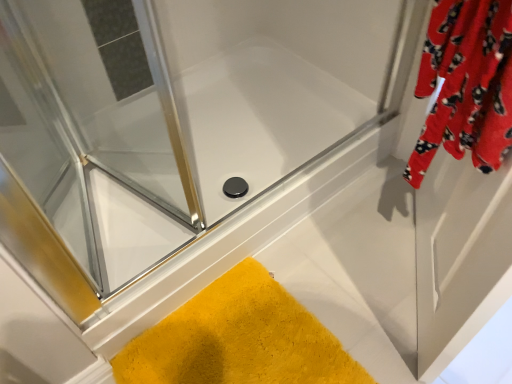
Question: Considering the relative positions of yellow fuzzy bath mat at lower left and transparent glass shower door at upper left, which is the 2th screen door from right to left, in the image provided, is yellow fuzzy bath mat at lower left to the right of transparent glass shower door at upper left, which is the 2th screen door from right to left, from the viewer's perspective?

Choices:
 (A) no
 (B) yes

Answer: (B)

Question: Is yellow fuzzy bath mat at lower left oriented towards transparent glass shower door at upper left, which is the 2th screen door from right to left?

Choices:
 (A) no
 (B) yes

Answer: (A)

Question: From the image's perspective, is yellow fuzzy bath mat at lower left over transparent glass shower door at upper left, which is the 2th screen door from right to left?

Choices:
 (A) yes
 (B) no

Answer: (B)

Question: Does yellow fuzzy bath mat at lower left appear on the left side of transparent glass shower door at upper left, the first screen door positioned from the left?

Choices:
 (A) no
 (B) yes

Answer: (A)

Question: Does yellow fuzzy bath mat at lower left have a lesser width compared to transparent glass shower door at upper left, the first screen door positioned from the left?

Choices:
 (A) no
 (B) yes

Answer: (B)

Question: Does point (75, 162) appear closer or farther from the camera than point (184, 382)?

Choices:
 (A) farther
 (B) closer

Answer: (A)

Question: From the image's perspective, relative to yellow fuzzy bath mat at lower left, is transparent glass shower door at upper left, the first screen door positioned from the left, above or below?

Choices:
 (A) below
 (B) above

Answer: (B)

Question: In terms of size, does transparent glass shower door at upper left, which is the 2th screen door from right to left, appear bigger or smaller than yellow fuzzy bath mat at lower left?

Choices:
 (A) big
 (B) small

Answer: (A)

Question: Based on their positions, is transparent glass shower door at upper left, the first screen door positioned from the left, located to the left or right of yellow fuzzy bath mat at lower left?

Choices:
 (A) right
 (B) left

Answer: (B)

Question: Is yellow fuzzy bath mat at lower left in front of or behind velvet red robe at upper right, which appears as the 1th screen door when viewed from the right, in the image?

Choices:
 (A) front
 (B) behind

Answer: (B)

Question: Is yellow fuzzy bath mat at lower left bigger or smaller than velvet red robe at upper right, which appears as the 1th screen door when viewed from the right?

Choices:
 (A) big
 (B) small

Answer: (B)

Question: Is yellow fuzzy bath mat at lower left taller or shorter than velvet red robe at upper right, positioned as the 2th screen door in left-to-right order?

Choices:
 (A) short
 (B) tall

Answer: (A)

Question: Do you think yellow fuzzy bath mat at lower left is within velvet red robe at upper right, positioned as the 2th screen door in left-to-right order, or outside of it?

Choices:
 (A) inside
 (B) outside

Answer: (B)

Question: In the image, is velvet red robe at upper right, which appears as the 1th screen door when viewed from the right, positioned in front of or behind transparent glass shower door at upper left, which is the 2th screen door from right to left?

Choices:
 (A) behind
 (B) front

Answer: (B)

Question: Visually, is velvet red robe at upper right, positioned as the 2th screen door in left-to-right order, positioned to the left or to the right of transparent glass shower door at upper left, which is the 2th screen door from right to left?

Choices:
 (A) left
 (B) right

Answer: (B)